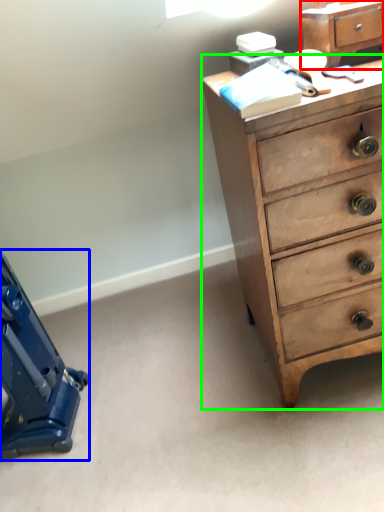
Question: Which object is the farthest from file cabinet (highlighted by a red box)? Choose among these: equipment (highlighted by a blue box) or chest of drawers (highlighted by a green box).

Choices:
 (A) equipment
 (B) chest of drawers

Answer: (A)